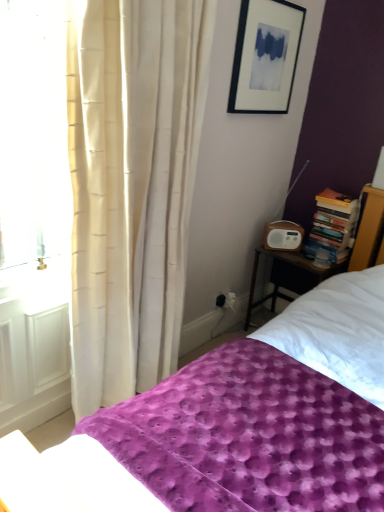
Question: Considering the relative sizes of purple textured blanket at lower center and hardcover books at right in the image provided, is purple textured blanket at lower center taller than hardcover books at right?

Choices:
 (A) yes
 (B) no

Answer: (A)

Question: Is purple textured blanket at lower center at the right side of hardcover books at right?

Choices:
 (A) no
 (B) yes

Answer: (A)

Question: Is purple textured blanket at lower center closer to camera compared to hardcover books at right?

Choices:
 (A) yes
 (B) no

Answer: (A)

Question: From the image's perspective, is purple textured blanket at lower center beneath hardcover books at right?

Choices:
 (A) no
 (B) yes

Answer: (B)

Question: Is purple textured blanket at lower center aimed at hardcover books at right?

Choices:
 (A) yes
 (B) no

Answer: (B)

Question: Do you think purple textured blanket at lower center is within black matte picture frame at upper center, or outside of it?

Choices:
 (A) outside
 (B) inside

Answer: (A)

Question: In terms of width, does purple textured blanket at lower center look wider or thinner when compared to black matte picture frame at upper center?

Choices:
 (A) thin
 (B) wide

Answer: (B)

Question: From a real-world perspective, relative to black matte picture frame at upper center, is purple textured blanket at lower center vertically above or below?

Choices:
 (A) above
 (B) below

Answer: (B)

Question: Is point (327, 419) positioned closer to the camera than point (264, 42)?

Choices:
 (A) closer
 (B) farther

Answer: (A)

Question: Looking at their shapes, would you say purple textured blanket at lower center is wider or thinner than wooden nightstand at right?

Choices:
 (A) thin
 (B) wide

Answer: (B)

Question: Considering the positions of purple textured blanket at lower center and wooden nightstand at right in the image, is purple textured blanket at lower center bigger or smaller than wooden nightstand at right?

Choices:
 (A) big
 (B) small

Answer: (A)

Question: Would you say purple textured blanket at lower center is to the left or to the right of wooden nightstand at right in the picture?

Choices:
 (A) left
 (B) right

Answer: (A)

Question: Does point (370, 346) appear closer or farther from the camera than point (246, 312)?

Choices:
 (A) farther
 (B) closer

Answer: (B)

Question: Based on their positions, is black matte picture frame at upper center located to the left or right of wooden nightstand at right?

Choices:
 (A) right
 (B) left

Answer: (B)

Question: Is black matte picture frame at upper center in front of or behind wooden nightstand at right in the image?

Choices:
 (A) behind
 (B) front

Answer: (B)